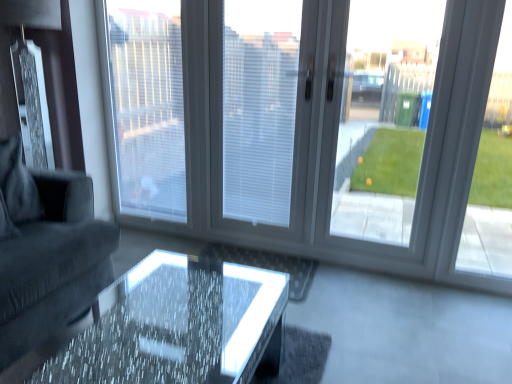
Question: Can you confirm if transparent glass door at right, arranged as the 3th window screen when viewed from the left, is positioned to the right of transparent glass window at center?

Choices:
 (A) no
 (B) yes

Answer: (B)

Question: Does transparent glass door at right, arranged as the 1th window screen when viewed from the right, lie behind transparent glass window at center?

Choices:
 (A) yes
 (B) no

Answer: (A)

Question: From a real-world perspective, is transparent glass door at right, arranged as the 3th window screen when viewed from the left, physically above transparent glass window at center?

Choices:
 (A) yes
 (B) no

Answer: (A)

Question: From the image's perspective, does transparent glass door at right, arranged as the 3th window screen when viewed from the left, appear lower than transparent glass window at center?

Choices:
 (A) no
 (B) yes

Answer: (B)

Question: Is transparent glass door at right, arranged as the 1th window screen when viewed from the right, to the left of transparent glass window at center from the viewer's perspective?

Choices:
 (A) no
 (B) yes

Answer: (A)

Question: Considering the relative sizes of translucent glass table at center and transparent glass door at right, arranged as the 3th window screen when viewed from the left, in the image provided, is translucent glass table at center taller than transparent glass door at right, arranged as the 3th window screen when viewed from the left,?

Choices:
 (A) yes
 (B) no

Answer: (B)

Question: Does translucent glass table at center have a greater width compared to transparent glass door at right, arranged as the 1th window screen when viewed from the right?

Choices:
 (A) yes
 (B) no

Answer: (A)

Question: Is translucent glass table at center not close to transparent glass door at right, arranged as the 3th window screen when viewed from the left?

Choices:
 (A) yes
 (B) no

Answer: (A)

Question: From the image's perspective, is translucent glass table at center located above transparent glass door at right, arranged as the 1th window screen when viewed from the right?

Choices:
 (A) yes
 (B) no

Answer: (B)

Question: Does translucent glass table at center have a larger size compared to transparent glass door at right, arranged as the 3th window screen when viewed from the left?

Choices:
 (A) yes
 (B) no

Answer: (A)

Question: From the image's perspective, is translucent glass table at center under transparent glass door at right, arranged as the 3th window screen when viewed from the left?

Choices:
 (A) yes
 (B) no

Answer: (A)

Question: From a real-world perspective, is transparent glass door at right, arranged as the 3th window screen when viewed from the left, positioned under dark gray fabric couch at left based on gravity?

Choices:
 (A) no
 (B) yes

Answer: (A)